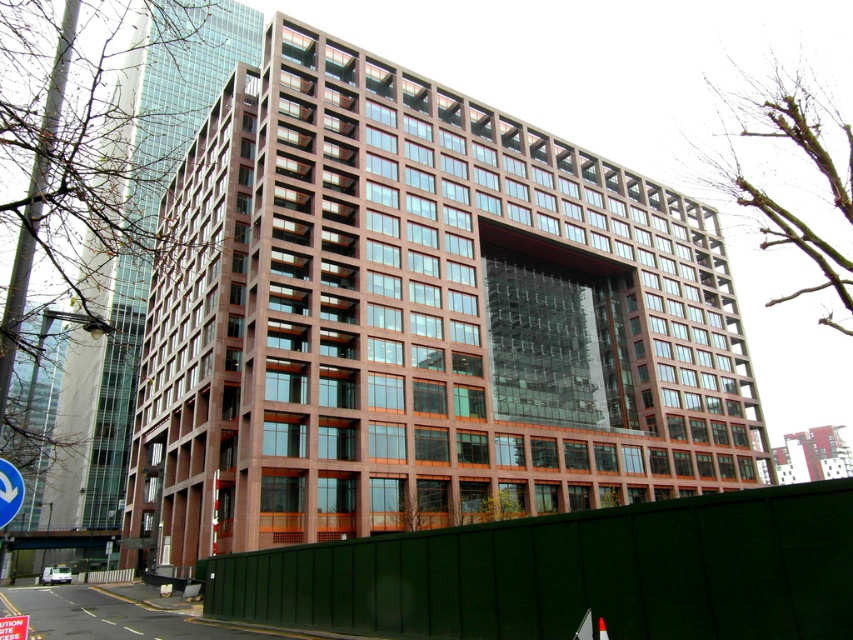
Question: Which of the following is the farthest from the observer?

Choices:
 (A) (3, 522)
 (B) (13, 627)

Answer: (B)

Question: Which point is closer to the camera?

Choices:
 (A) (16, 496)
 (B) (21, 632)

Answer: (A)

Question: Observing the image, what is the correct spatial positioning of metallic silver arrow at center in reference to metallic reflective traffic sign at center?

Choices:
 (A) left
 (B) right

Answer: (B)

Question: Where is metallic silver arrow at center located in relation to metallic reflective traffic sign at center in the image?

Choices:
 (A) right
 (B) left

Answer: (A)

Question: Is metallic silver arrow at center positioned at the back of metallic reflective traffic sign at center?

Choices:
 (A) no
 (B) yes

Answer: (A)